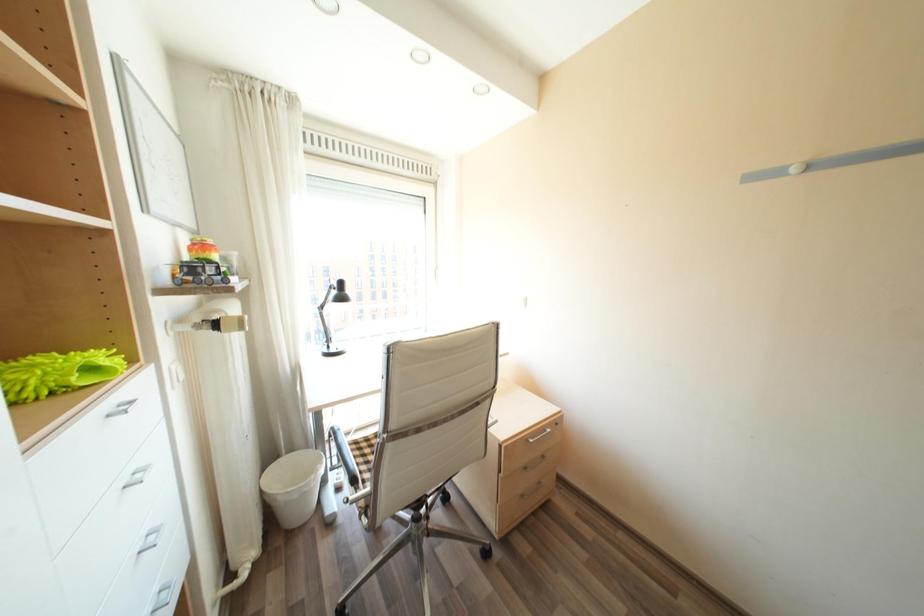
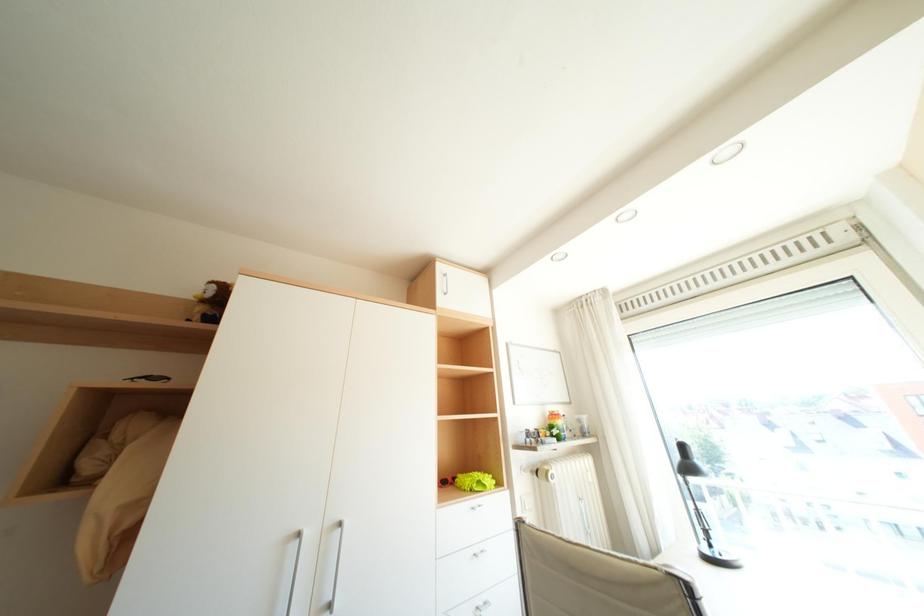
First-person continuous shooting, in which direction is the camera rotating?

The camera's rotation is toward left-up.